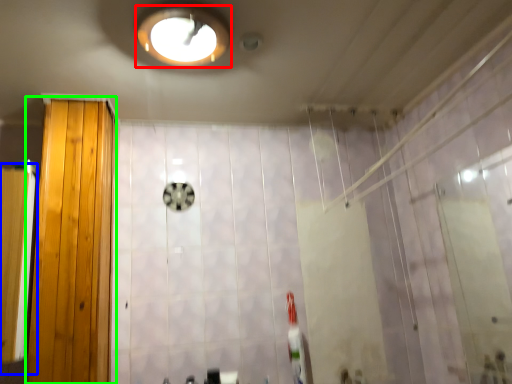
Question: Which object is positioned closest to light fixture (highlighted by a red box)? Select from screen door (highlighted by a blue box) and door (highlighted by a green box).

Choices:
 (A) screen door
 (B) door

Answer: (B)